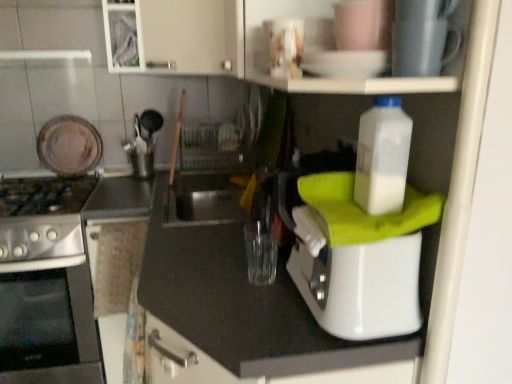
This screenshot has height=384, width=512. What are the coordinates of `vacant point to the left of matte brown plate at upper left, which is the 1th appliance from back to front` in the screenshot? It's located at (30, 177).